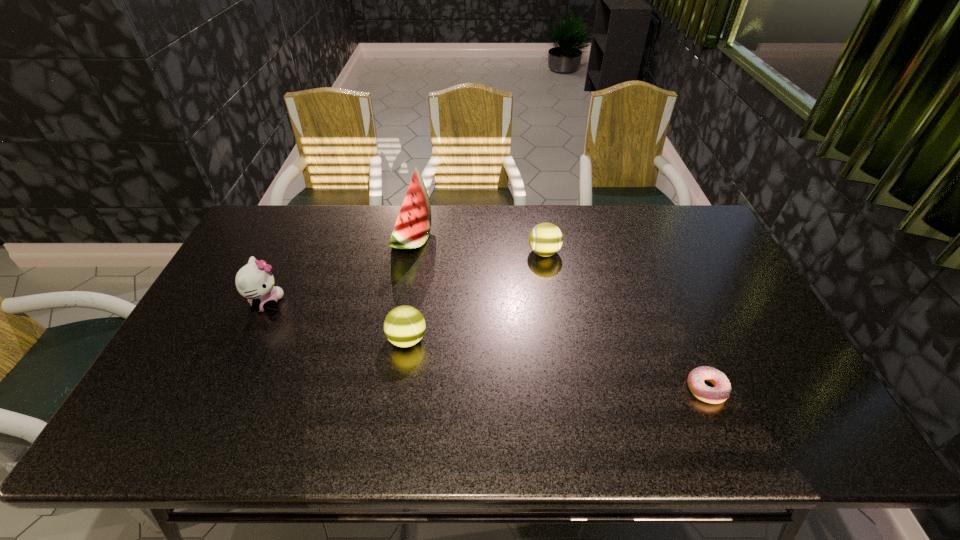
In order to click on vacant space in between the third farthest object and the watermelon in this screenshot , I will do `click(339, 271)`.

Find the location of a particular element. empty location between the farther tennis ball and the left tennis ball is located at coordinates (475, 296).

Image resolution: width=960 pixels, height=540 pixels. Identify the location of free point between the second object from right to left and the second tallest object. pyautogui.click(x=405, y=278).

Identify which object is the nearest to the farther tennis ball. Please provide its 2D coordinates. Your answer should be formatted as a tuple, i.e. [(x, y)], where the tuple contains the x and y coordinates of a point satisfying the conditions above.

[(412, 228)]

Identify the location of the third closest object to the fourth farthest object. (545, 239).

Identify the location of free space that satisfies the following two spatial constraints: 1. on the outer rind of the tallest object; 2. on the back side of the nearer tennis ball. (394, 339).

This screenshot has height=540, width=960. Identify the location of free space that satisfies the following two spatial constraints: 1. on the front-facing side of the second nearest object; 2. on the right side of the kitten. (250, 339).

The width and height of the screenshot is (960, 540). What are the coordinates of `free region that satisfies the following two spatial constraints: 1. on the front-facing side of the leftmost object; 2. on the back side of the doughnut` in the screenshot? It's located at (227, 389).

At what (x,y) coordinates should I click in order to perform the action: click on vacant space that satisfies the following two spatial constraints: 1. on the outer rind of the watermelon; 2. on the back side of the right tennis ball. Please return your answer as a coordinate pair (x, y). The image size is (960, 540). Looking at the image, I should click on (409, 253).

This screenshot has width=960, height=540. I want to click on free point that satisfies the following two spatial constraints: 1. on the front-facing side of the doughnut; 2. on the left side of the leftmost object, so click(227, 389).